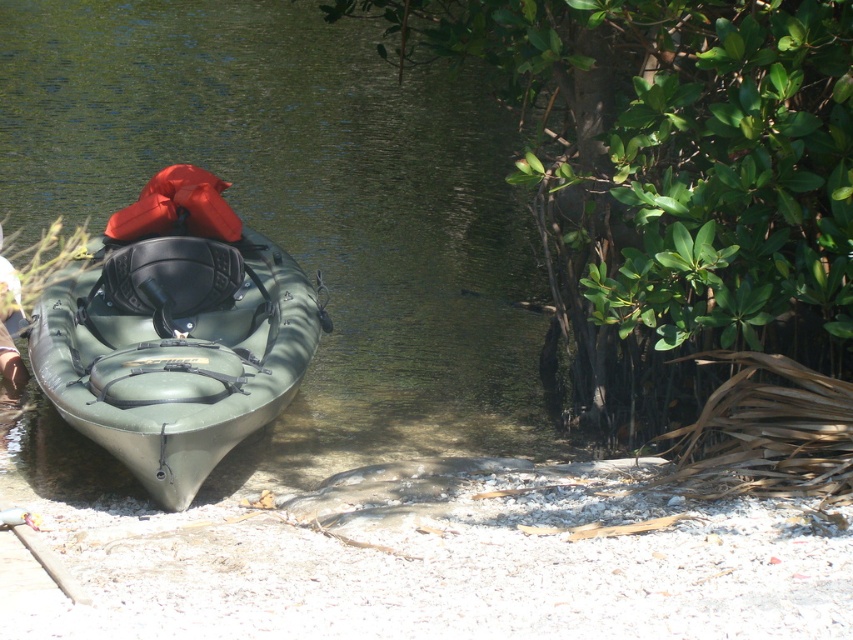
Question: Does white sand at lower left appear under orange matte life jacket at center?

Choices:
 (A) no
 (B) yes

Answer: (B)

Question: Does green rubber kayak at center have a lesser width compared to matte green kayak at center?

Choices:
 (A) no
 (B) yes

Answer: (A)

Question: Which is nearer to the light brown leather shoe at lower left?

Choices:
 (A) green rubber kayak at center
 (B) orange matte life jacket at center
 (C) white sand at lower left
 (D) matte green kayak at center

Answer: (B)

Question: Where is white sand at lower left located in relation to light brown leather shoe at lower left in the image?

Choices:
 (A) right
 (B) left

Answer: (A)

Question: Which is nearer to the orange matte life jacket at center?

Choices:
 (A) green rubber kayak at center
 (B) white sand at lower left
 (C) light brown leather shoe at lower left
 (D) matte green kayak at center

Answer: (C)

Question: Which of the following is the farthest from the observer?

Choices:
 (A) (9, 291)
 (B) (757, 611)
 (C) (175, 426)

Answer: (A)